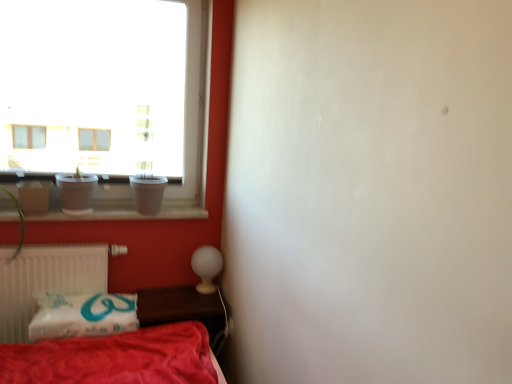
Question: Should I look upward or downward to see green matte plant at left?

Choices:
 (A) down
 (B) up

Answer: (A)

Question: From a real-world perspective, is red cotton blanket at lower left located beneath wooden table at lower center?

Choices:
 (A) yes
 (B) no

Answer: (B)

Question: Is red cotton blanket at lower left at the left side of wooden table at lower center?

Choices:
 (A) yes
 (B) no

Answer: (A)

Question: Is there a large distance between red cotton blanket at lower left and wooden table at lower center?

Choices:
 (A) yes
 (B) no

Answer: (B)

Question: Is red cotton blanket at lower left positioned before wooden table at lower center?

Choices:
 (A) yes
 (B) no

Answer: (A)

Question: Is red cotton blanket at lower left taller than wooden table at lower center?

Choices:
 (A) yes
 (B) no

Answer: (A)

Question: Is red cotton blanket at lower left to the right of wooden table at lower center from the viewer's perspective?

Choices:
 (A) no
 (B) yes

Answer: (A)

Question: Considering the relative positions of wooden table at lower center and green matte plant at left in the image provided, is wooden table at lower center to the left of green matte plant at left from the viewer's perspective?

Choices:
 (A) no
 (B) yes

Answer: (A)

Question: Is wooden table at lower center wider than green matte plant at left?

Choices:
 (A) no
 (B) yes

Answer: (B)

Question: Does wooden table at lower center have a larger size compared to green matte plant at left?

Choices:
 (A) yes
 (B) no

Answer: (B)

Question: Is the surface of wooden table at lower center in direct contact with green matte plant at left?

Choices:
 (A) no
 (B) yes

Answer: (A)

Question: Can you confirm if wooden table at lower center is shorter than green matte plant at left?

Choices:
 (A) no
 (B) yes

Answer: (B)

Question: Does wooden table at lower center have a smaller size compared to green matte plant at left?

Choices:
 (A) no
 (B) yes

Answer: (B)

Question: From the image's perspective, is transparent glass vase at left beneath red cotton blanket at lower left?

Choices:
 (A) no
 (B) yes

Answer: (A)